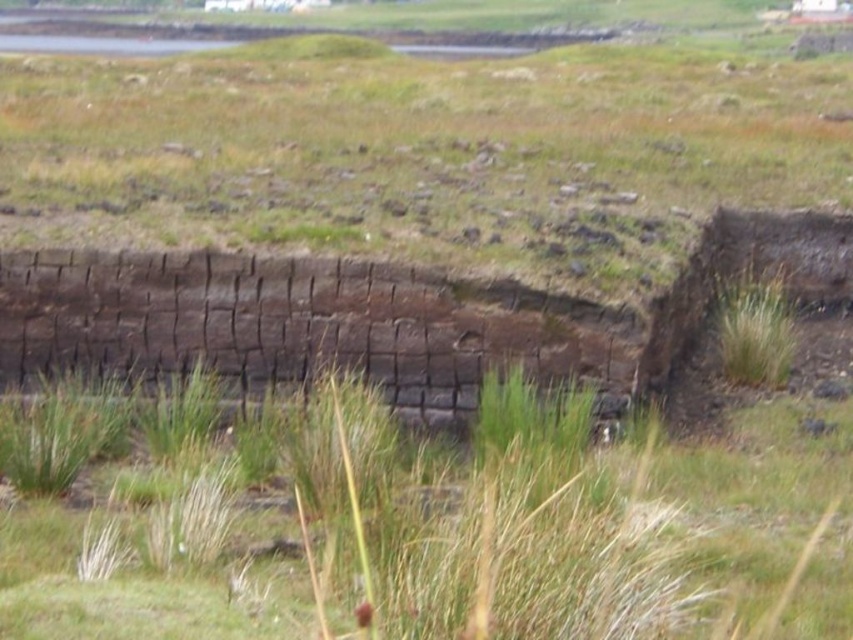
Can you confirm if green grassy at center is thinner than brown stone wall at center?

In fact, green grassy at center might be wider than brown stone wall at center.

Does green grassy at center have a greater width compared to brown stone wall at center?

Yes, green grassy at center is wider than brown stone wall at center.

Is point (140, 502) positioned after point (190, 346)?

That is False.

Where is `green grassy at center`? green grassy at center is located at coordinates (480, 524).